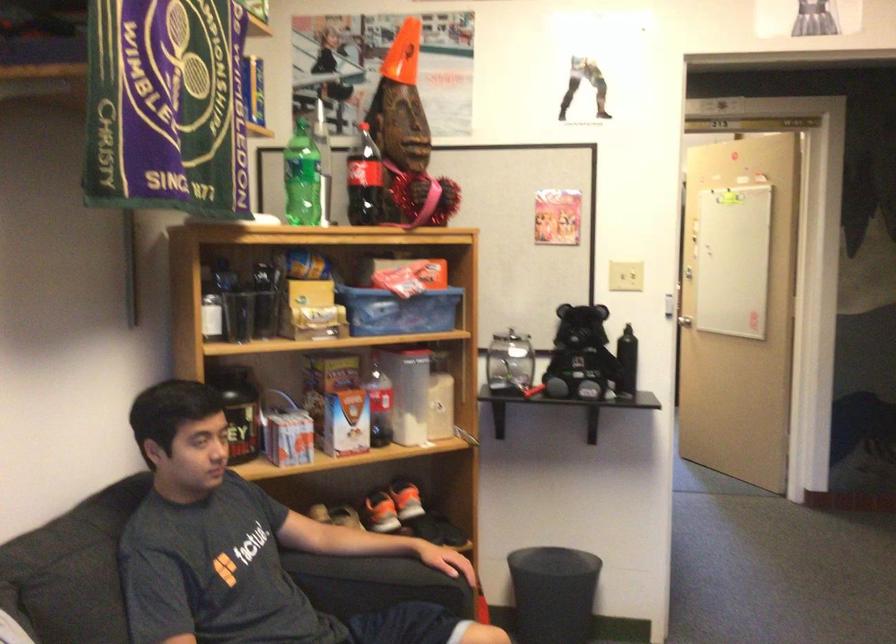
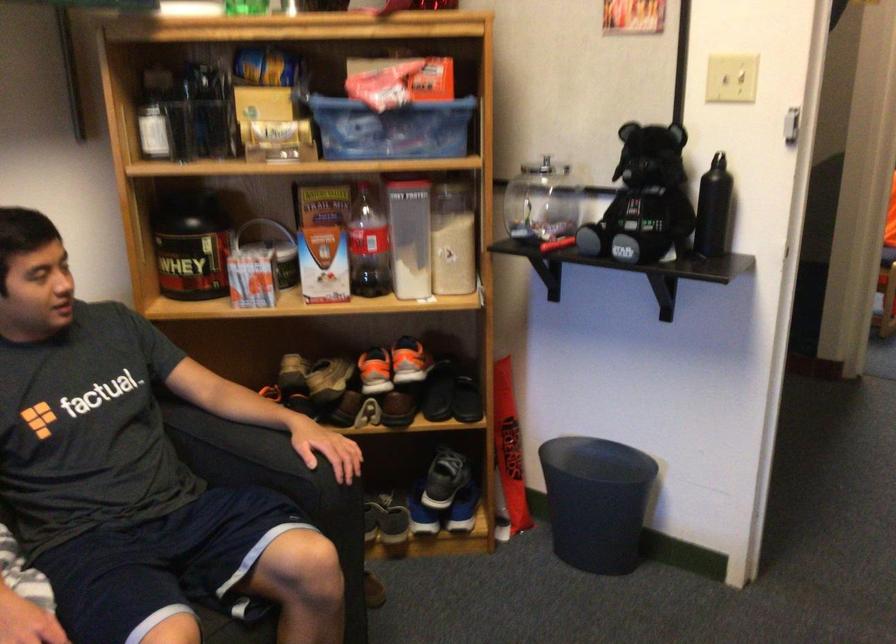
In the second image, find the point that corresponds to pixel 636 361 in the first image.

(712, 209)